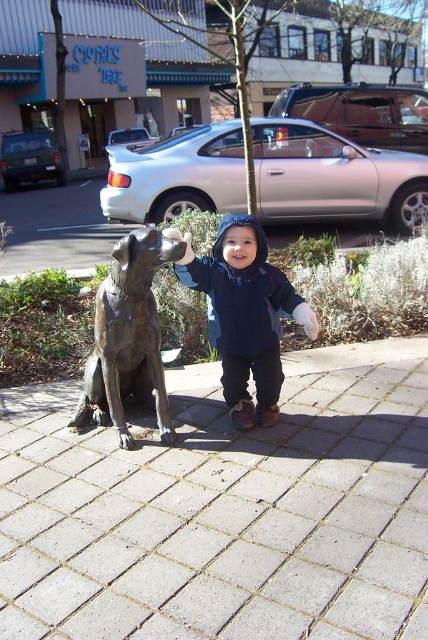
Can you confirm if paved stone pavement at center is wider than matte blue jacket at center?

Correct, the width of paved stone pavement at center exceeds that of matte blue jacket at center.

The width and height of the screenshot is (428, 640). Identify the location of paved stone pavement at center. (225, 509).

Between point (140, 492) and point (121, 248), which one is positioned behind?

The point (121, 248) is behind.

Between paved stone pavement at center and bronze statue at left, which one appears on the right side from the viewer's perspective?

Positioned to the right is paved stone pavement at center.

What are the coordinates of `paved stone pavement at center` in the screenshot? It's located at (225, 509).

Is matte blue jacket at center to the right of bronze statue at left from the viewer's perspective?

Indeed, matte blue jacket at center is positioned on the right side of bronze statue at left.

Based on the photo, is matte blue jacket at center below bronze statue at left?

No.

Who is more forward, (282, 300) or (174, 432)?

Point (282, 300) is in front.

This screenshot has height=640, width=428. In order to click on matte blue jacket at center in this screenshot , I will do `click(244, 314)`.